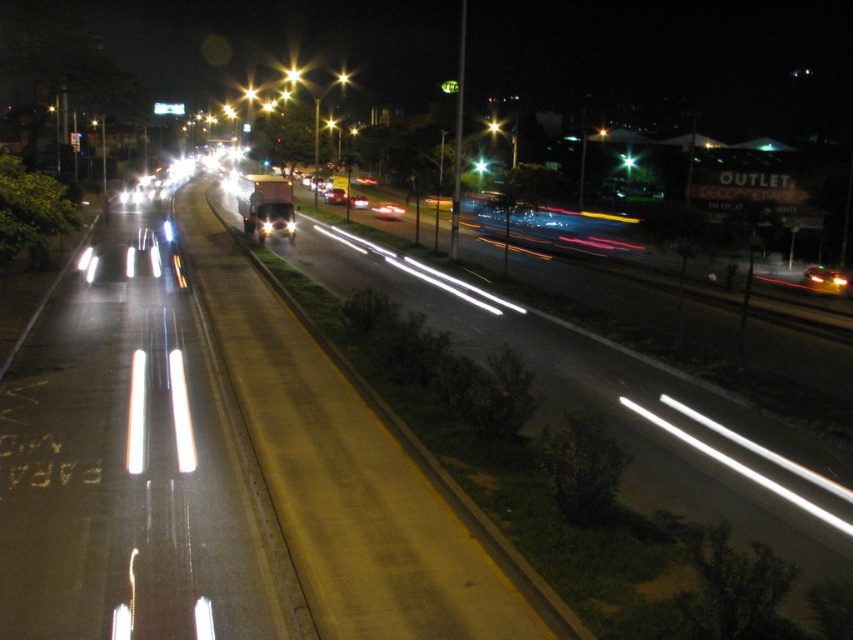
Question: Which of the following is the farthest from the observer?

Choices:
 (A) matte black car at center
 (B) bright metallic streetlight at center

Answer: (B)

Question: Which object appears closest to the camera in this image?

Choices:
 (A) bright yellow streetlight at upper center
 (B) matte black car at center
 (C) bright metallic streetlight at center
 (D) shiny silver car at center

Answer: (D)

Question: Is bright metallic streetlight at center below bright yellow streetlight at upper center?

Choices:
 (A) no
 (B) yes

Answer: (B)

Question: Among these objects, which one is nearest to the camera?

Choices:
 (A) bright yellow streetlight at upper center
 (B) bright metallic streetlight at center
 (C) matte black car at center
 (D) shiny silver car at center

Answer: (D)

Question: Is bright metallic streetlight at center behind bright yellow streetlight at upper center?

Choices:
 (A) yes
 (B) no

Answer: (B)

Question: Is shiny silver sedan at center positioned in front of matte black car at center?

Choices:
 (A) yes
 (B) no

Answer: (B)